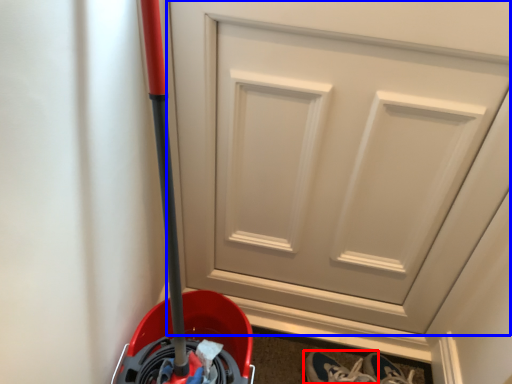
Question: Which object is closer to the camera taking this photo, footwear (highlighted by a red box) or door (highlighted by a blue box)?

Choices:
 (A) footwear
 (B) door

Answer: (B)